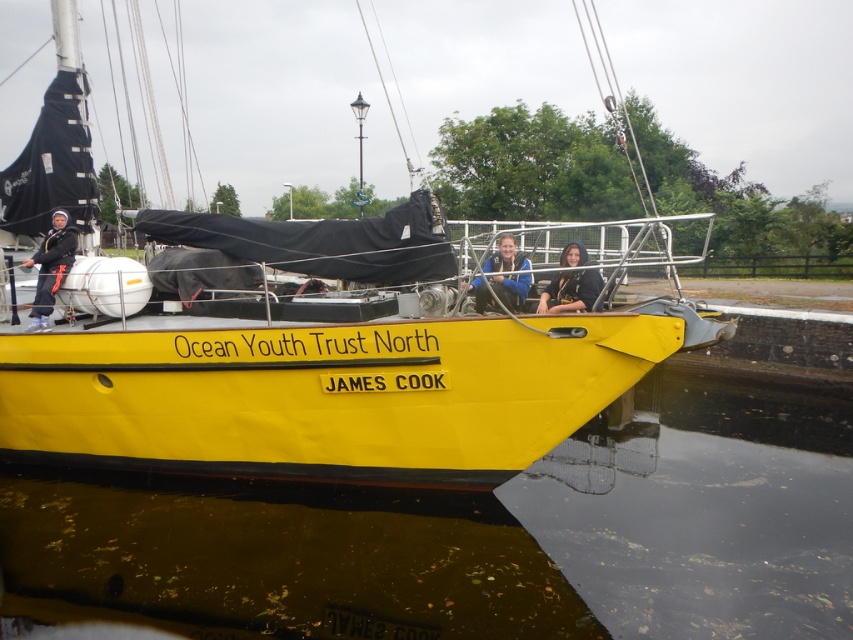
Question: Which point appears farthest from the camera in this image?

Choices:
 (A) (577, 560)
 (B) (506, 256)
 (C) (61, 260)
 (D) (572, 253)

Answer: (C)

Question: Is transparent water at lower center above black matte jacket at center?

Choices:
 (A) no
 (B) yes

Answer: (A)

Question: Is matte black jacket at left to the right of black matte jacket at center from the viewer's perspective?

Choices:
 (A) no
 (B) yes

Answer: (A)

Question: Which point is closer to the camera?

Choices:
 (A) (57, 275)
 (B) (751, 502)
 (C) (131, 323)
 (D) (491, 278)

Answer: (D)

Question: Does yellow matte boat at center have a greater width compared to black matte jacket at center?

Choices:
 (A) yes
 (B) no

Answer: (B)

Question: Which of these objects is positioned farthest from the blue fabric jacket at center?

Choices:
 (A) black matte jacket at center
 (B) matte black jacket at left
 (C) yellow matte boat at center

Answer: (B)